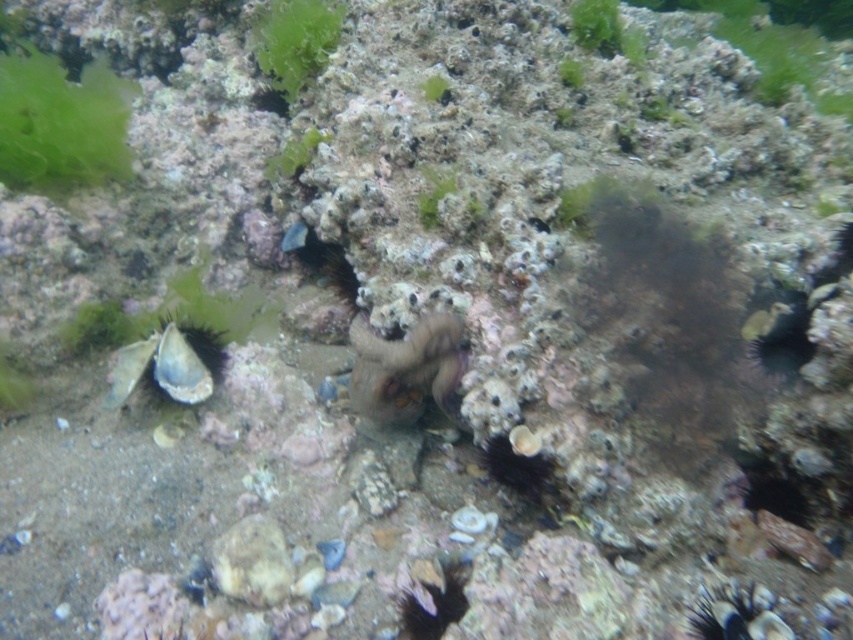
Question: Does green leafy algae at upper left have a larger size compared to green matte algae at upper center?

Choices:
 (A) no
 (B) yes

Answer: (B)

Question: Which of the following is the farthest from the observer?

Choices:
 (A) (210, 387)
 (B) (450, 408)
 (C) (30, 132)

Answer: (C)

Question: In this image, where is green leafy algae at upper left located relative to purple rubber octopus at center?

Choices:
 (A) left
 (B) right

Answer: (A)

Question: Can you confirm if green leafy algae at upper left is positioned below purple rubber octopus at center?

Choices:
 (A) no
 (B) yes

Answer: (A)

Question: Which of the following is the farthest from the observer?

Choices:
 (A) green leafy algae at upper left
 (B) blue spiky shell at lower left
 (C) green matte algae at upper center
 (D) purple rubber octopus at center

Answer: (C)

Question: Which is farther from the purple rubber octopus at center?

Choices:
 (A) blue spiky shell at lower left
 (B) green leafy algae at upper left
 (C) green matte algae at upper center

Answer: (B)